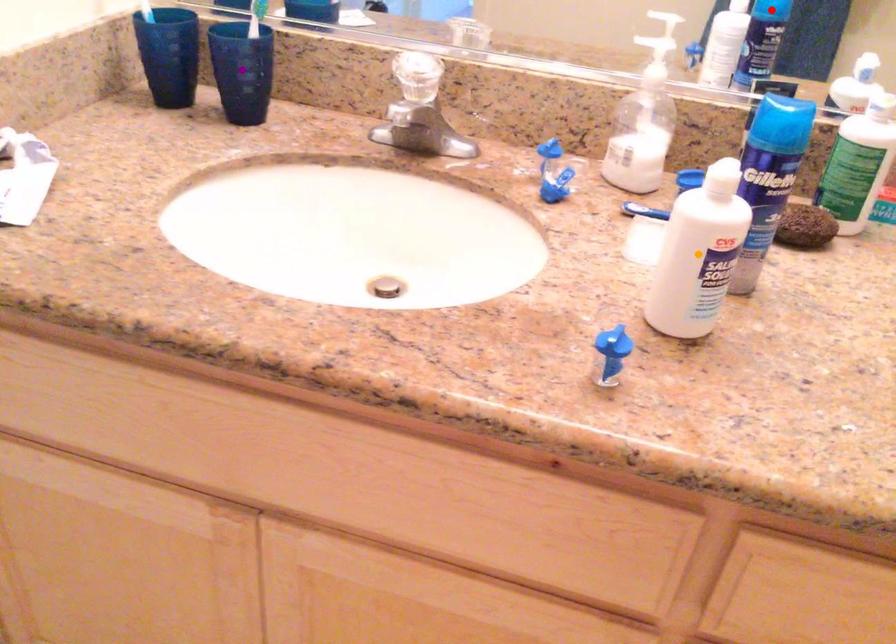
Order these from nearest to farthest:
1. purple point
2. red point
3. orange point

1. red point
2. purple point
3. orange point